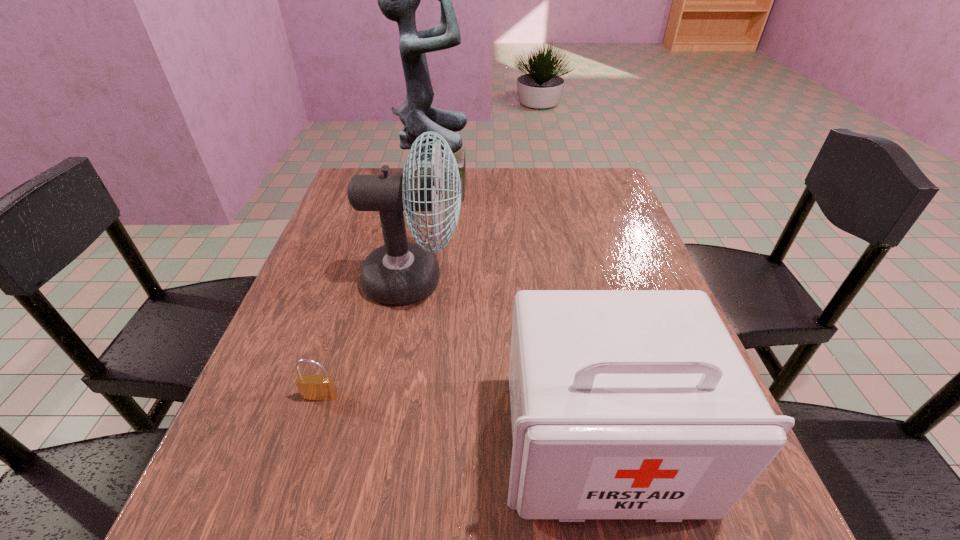
Find the location of `unoccupied position between the third nearest object and the shortest object`. unoccupied position between the third nearest object and the shortest object is located at coordinates (367, 339).

Find the location of `vacant space in between the third nearest object and the padlock`. vacant space in between the third nearest object and the padlock is located at coordinates (367, 339).

This screenshot has width=960, height=540. Identify the location of unoccupied area between the padlock and the second tallest object. (367, 339).

This screenshot has width=960, height=540. I want to click on vacant space that is in between the padlock and the fan, so click(367, 339).

Find the location of `empty space that is in between the third shortest object and the tallest object`. empty space that is in between the third shortest object and the tallest object is located at coordinates (424, 233).

Where is `free area in between the fan and the sculpture`? free area in between the fan and the sculpture is located at coordinates click(424, 233).

Find the location of a particular element. This screenshot has height=540, width=960. object that can be found as the closest to the padlock is located at coordinates (399, 272).

Identify which object is the second closest to the second shortest object. Please provide its 2D coordinates. Your answer should be formatted as a tuple, i.e. [(x, y)], where the tuple contains the x and y coordinates of a point satisfying the conditions above.

[(311, 387)]

You are a GUI agent. You are given a task and a screenshot of the screen. Output one action in this format:
    pyautogui.click(x=<x>, y=<y>)
    Task: Click on the vacant space that satisfies the following two spatial constraints: 1. in front of the second tallest object where the airflow is directed; 2. on the front-facing side of the shortest object
    
    Given the screenshot: What is the action you would take?
    pyautogui.click(x=394, y=396)

This screenshot has height=540, width=960. What are the coordinates of `vacant space that satisfies the following two spatial constraints: 1. on the face of the sculpture; 2. on the front-facing side of the padlock` in the screenshot? It's located at (402, 396).